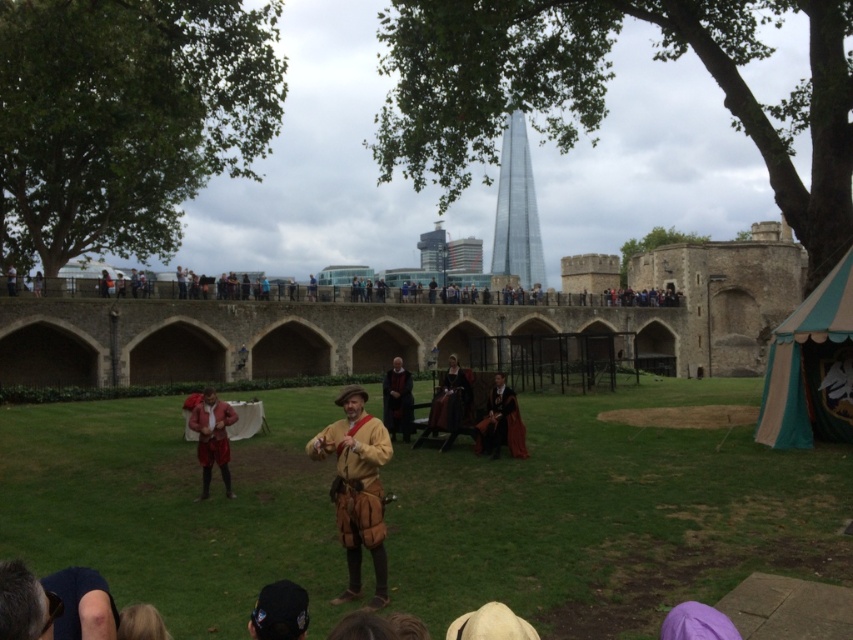
Who is taller, leather brown vest at center or glassy steel tower at center?

Standing taller between the two is glassy steel tower at center.

Does leather brown vest at center come in front of glassy steel tower at center?

Yes.

What do you see at coordinates (357, 488) in the screenshot? I see `leather brown vest at center` at bounding box center [357, 488].

Find the location of a particular element. The width and height of the screenshot is (853, 640). leather brown vest at center is located at coordinates (357, 488).

Does matte red fabric at center appear on the left side of smooth black robe at center?

Indeed, matte red fabric at center is positioned on the left side of smooth black robe at center.

Is point (206, 412) positioned behind point (401, 424)?

No, it is not.

Does point (195, 406) come behind point (393, 356)?

No, (195, 406) is closer to viewer.

You are a GUI agent. You are given a task and a screenshot of the screen. Output one action in this format:
    pyautogui.click(x=<x>, y=<y>)
    Task: Click on the matte red fabric at center
    This screenshot has height=640, width=853.
    Given the screenshot: What is the action you would take?
    pyautogui.click(x=212, y=436)

Is glassy steel tower at center positioned before matte red fabric at center?

No, glassy steel tower at center is behind matte red fabric at center.

Does glassy steel tower at center have a greater width compared to matte red fabric at center?

Indeed, glassy steel tower at center has a greater width compared to matte red fabric at center.

Who is more distant from viewer, (524, 273) or (225, 413)?

Point (524, 273)

This screenshot has height=640, width=853. Identify the location of glassy steel tower at center. (515, 211).